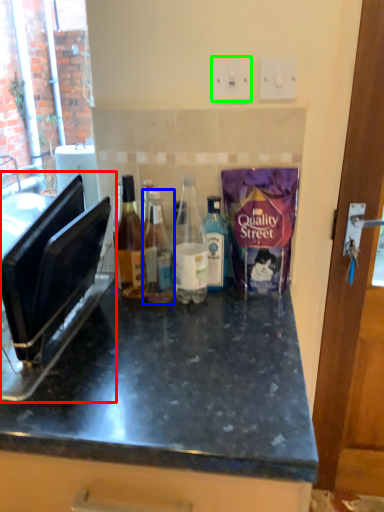
Question: Considering the real-world distances, which object is closest to appliance (highlighted by a red box)? bottle (highlighted by a blue box) or electric outlet (highlighted by a green box).

Choices:
 (A) bottle
 (B) electric outlet

Answer: (A)